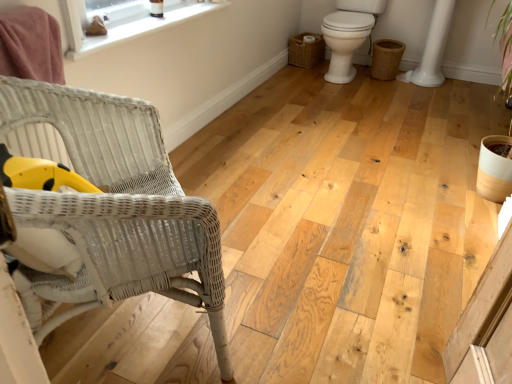
Identify the location of free location above woven brown basket at right, the second basket viewed from the right (from a real-world perspective). (307, 37).